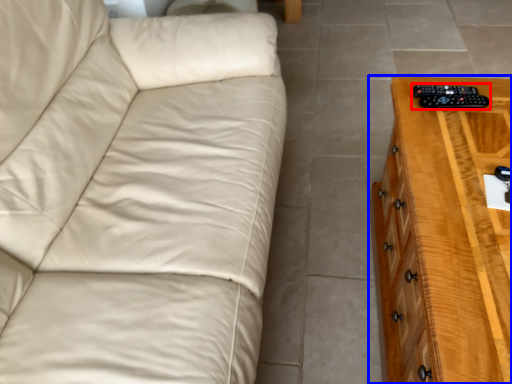
Question: Among these objects, which one is farthest to the camera, control (highlighted by a red box) or chest of drawers (highlighted by a blue box)?

Choices:
 (A) control
 (B) chest of drawers

Answer: (A)